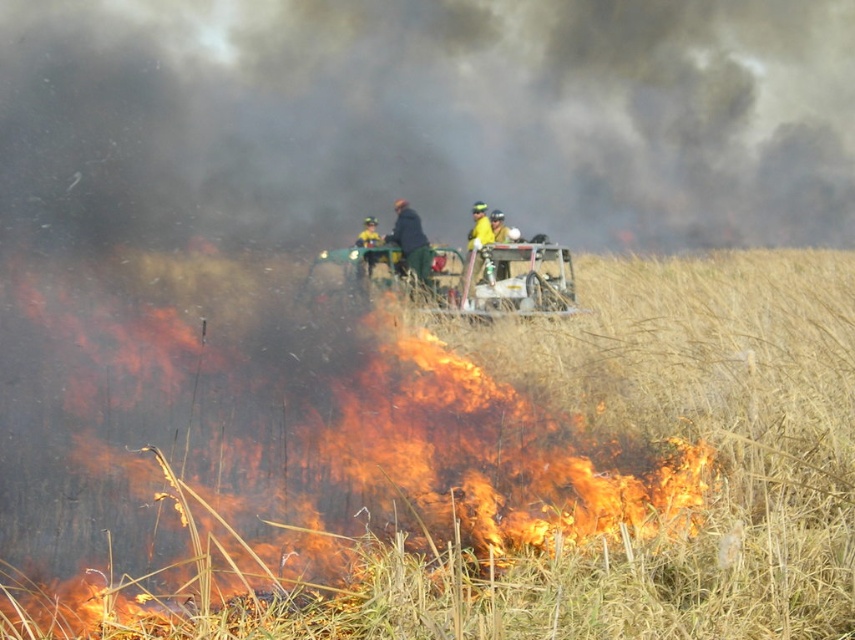
You are a firefighter trying to contain the fire. You need to place a water cannon at point A. The coordinates of point A are given as point A is at point 0.708, 0.401. Where should you aim the water cannon to target the flaming grass at center?

The flaming grass at center is located at point (342,452), so you should aim the water cannon at point A to target the flaming grass at center.

You are a firefighter trying to reach the equipment operator in the yellow reflective jacket at center. You are currently at the position of the dark blue jacket at center. Can you directly approach them without moving past the flames in the foreground?

The dark blue jacket at center is in front of the yellow reflective jacket at center, so you are already in front of them. To reach the yellow reflective jacket at center, you would need to move backward away from the flames in the foreground.